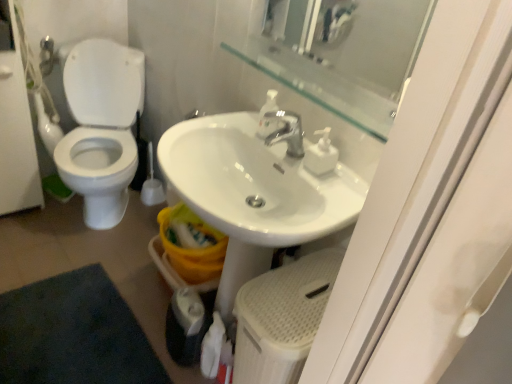
You are a GUI agent. You are given a task and a screenshot of the screen. Output one action in this format:
    pyautogui.click(x=<x>, y=<y>)
    Task: Click on the vacant area that is in front of white plastic soap dispenser at center, which is the 2th soap dispenser in left-to-right order
    Image resolution: width=512 pixels, height=384 pixels.
    Given the screenshot: What is the action you would take?
    pyautogui.click(x=329, y=194)